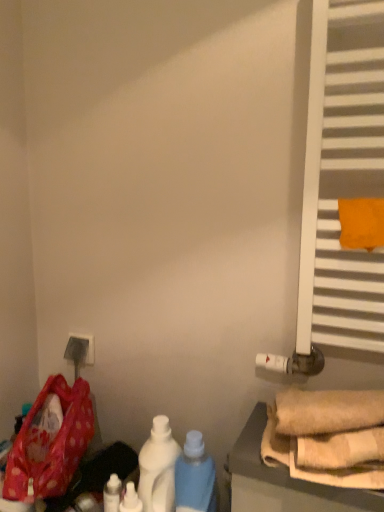
Question: From a real-world perspective, relative to white glossy bottle at lower center, which ranks as the third bottle in right-to-left order, is white matte bottle at center, placed as the third bottle when sorted from left to right, vertically above or below?

Choices:
 (A) above
 (B) below

Answer: (A)

Question: Is point (155, 416) positioned closer to the camera than point (125, 500)?

Choices:
 (A) closer
 (B) farther

Answer: (B)

Question: Which is farther from the white matte bottle at center, placed as the second bottle when sorted from right to left?

Choices:
 (A) white glossy bottle at lower center, which ranks as the third bottle in right-to-left order
 (B) orange fabric towel at right
 (C) polka dot fabric bag at lower left
 (D) white glossy bottle at lower center, which is the first bottle from right to left
 (E) matte plastic outlet at lower left

Answer: (B)

Question: Based on their relative distances, which object is nearer to the white glossy bottle at lower center, which ranks as the third bottle in right-to-left order?

Choices:
 (A) white matte radiator at right
 (B) orange fabric towel at right
 (C) white glossy bottle at lower center, which is the first bottle from right to left
 (D) beige fabric towels at lower right
 (E) white glossy bottle at lower left, marked as the 1th bottle in a left-to-right arrangement

Answer: (E)